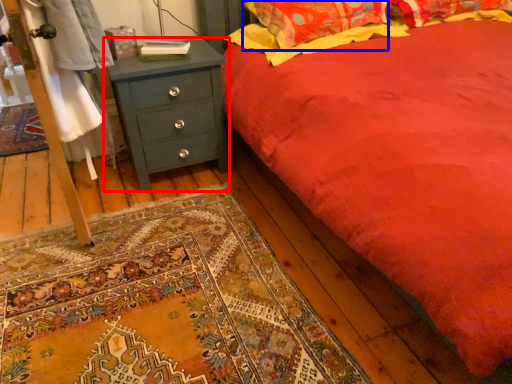
Question: Which object appears farthest to the camera in this image, chest of drawers (highlighted by a red box) or pillow (highlighted by a blue box)?

Choices:
 (A) chest of drawers
 (B) pillow

Answer: (B)